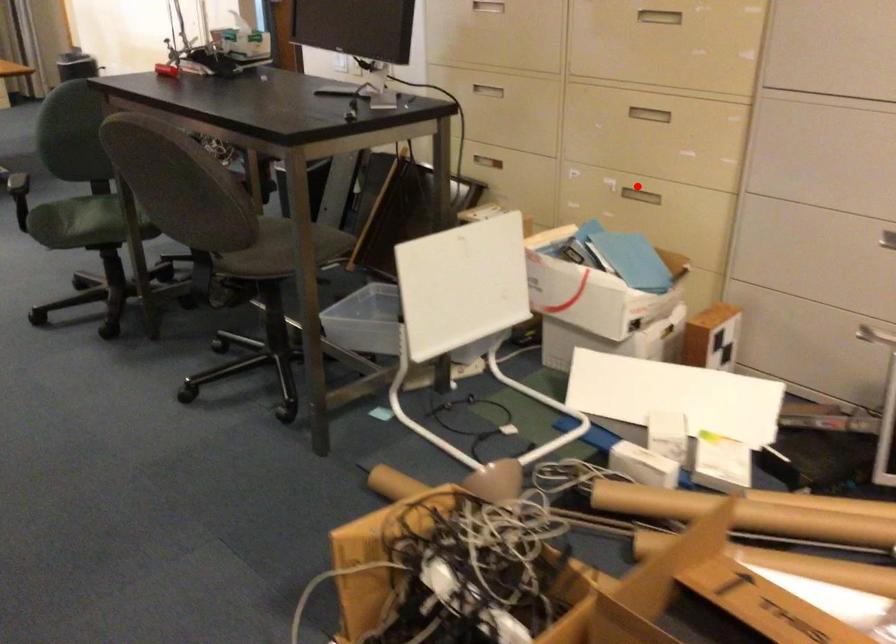
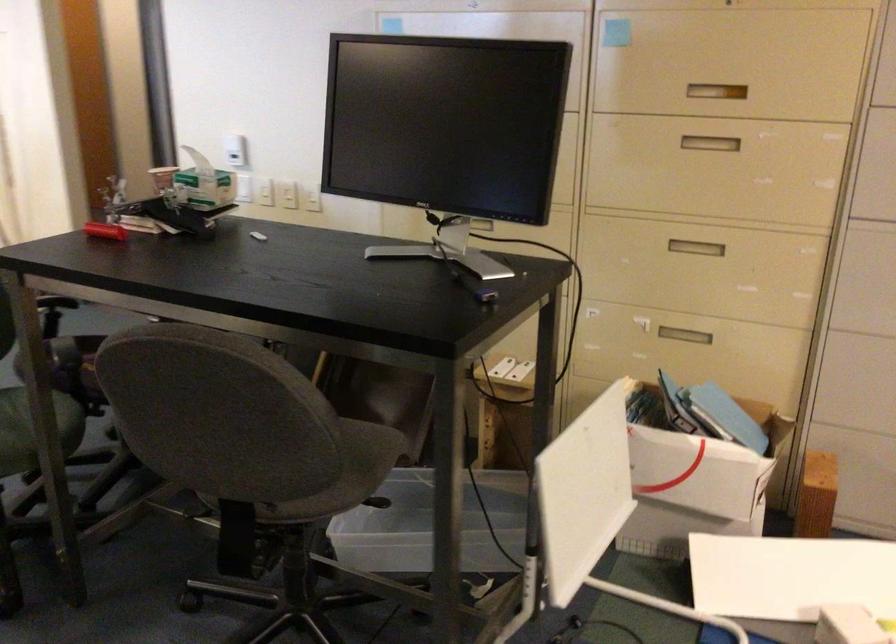
Question: A red point is marked in image1. In image2, is the corresponding 3D point closer to the camera or farther? Reply with the corresponding letter.

Choices:
 (A) The corresponding 3D point is closer.
 (B) The corresponding 3D point is farther.

Answer: (A)